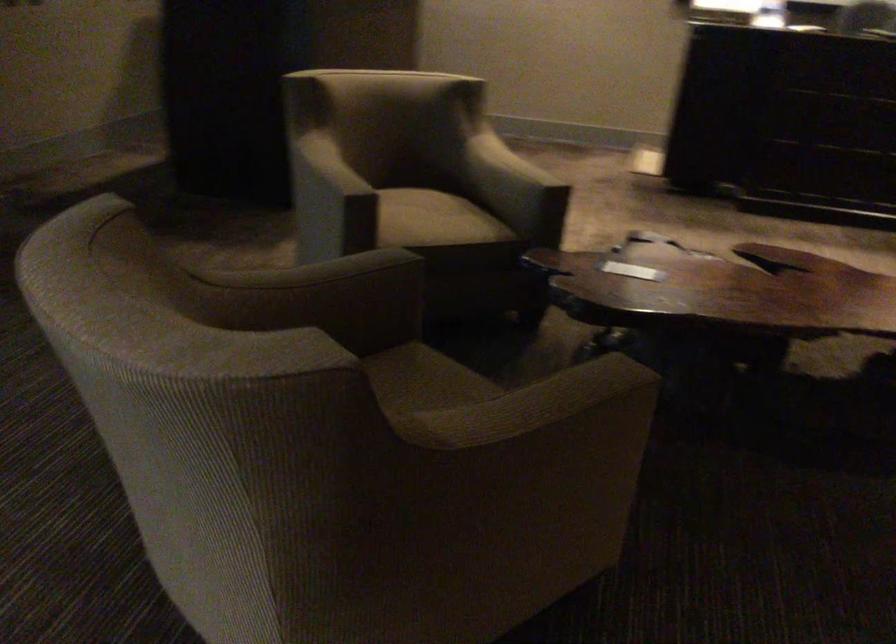
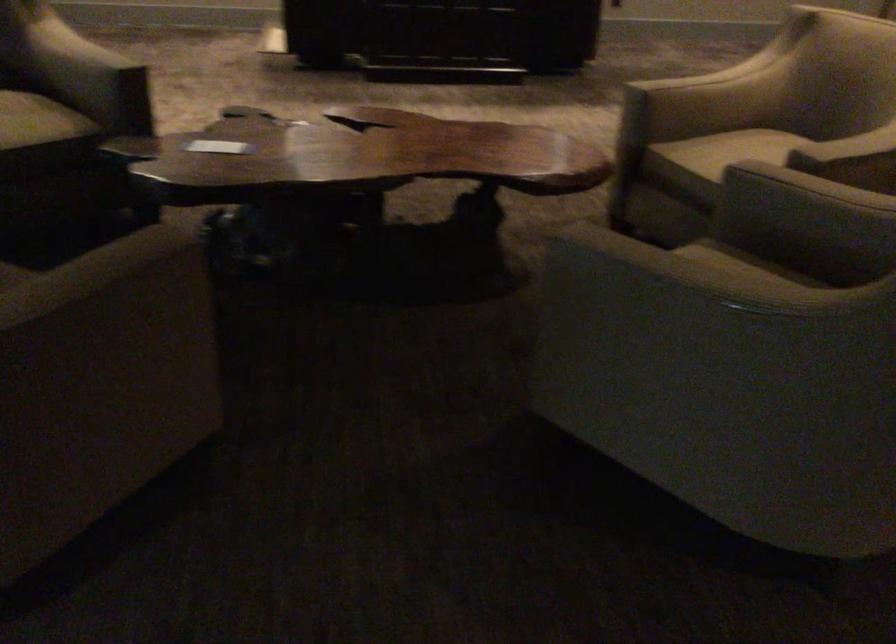
In the second image, find the point that corresponds to (583,412) in the first image.

(128, 287)